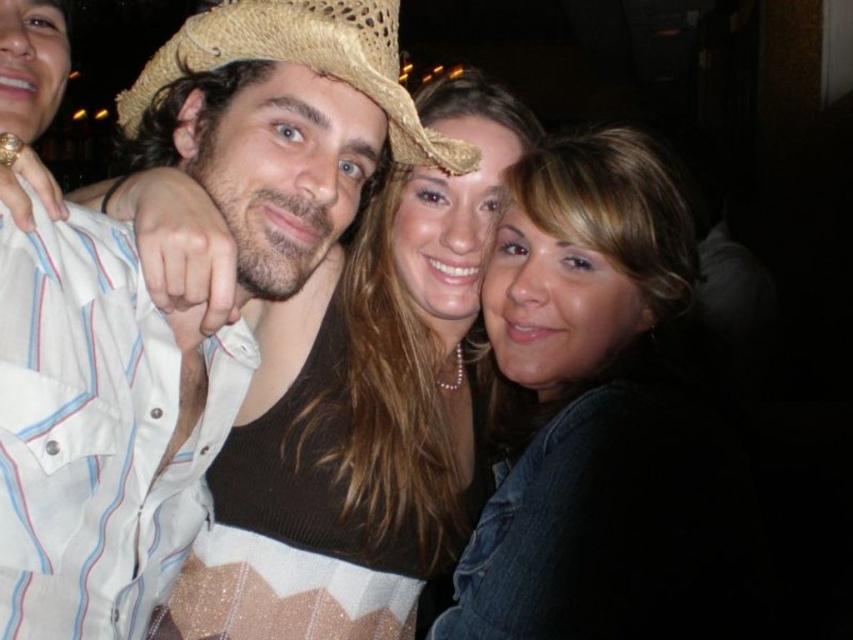
You are a photographer trying to capture a clear shot of both the matte straw hat at center and the strawhat at center. Which one will appear larger in the photo due to its height?

The matte straw hat at center will appear larger in the photo because it is much taller than the strawhat at center.

In the nighttime group photo, there are two hats mentioned in the scene. The first is the matte straw hat at center and the second is the strawhat at center. Which of these two hats is positioned to the left in the image?

The matte straw hat at center is to the left of the strawhat at center, so the matte straw hat at center is positioned to the left in the image.